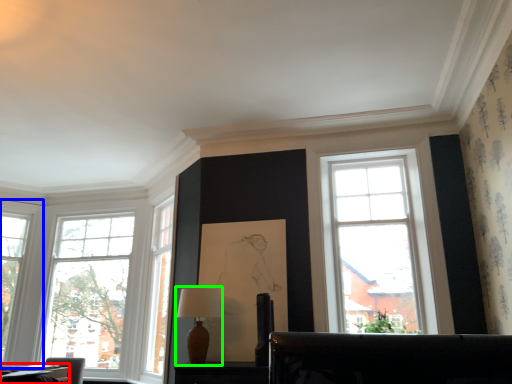
Question: Based on their relative distances, which object is nearer to table (highlighted by a red box)? Choose from window (highlighted by a blue box) and table lamp (highlighted by a green box).

Choices:
 (A) window
 (B) table lamp

Answer: (A)